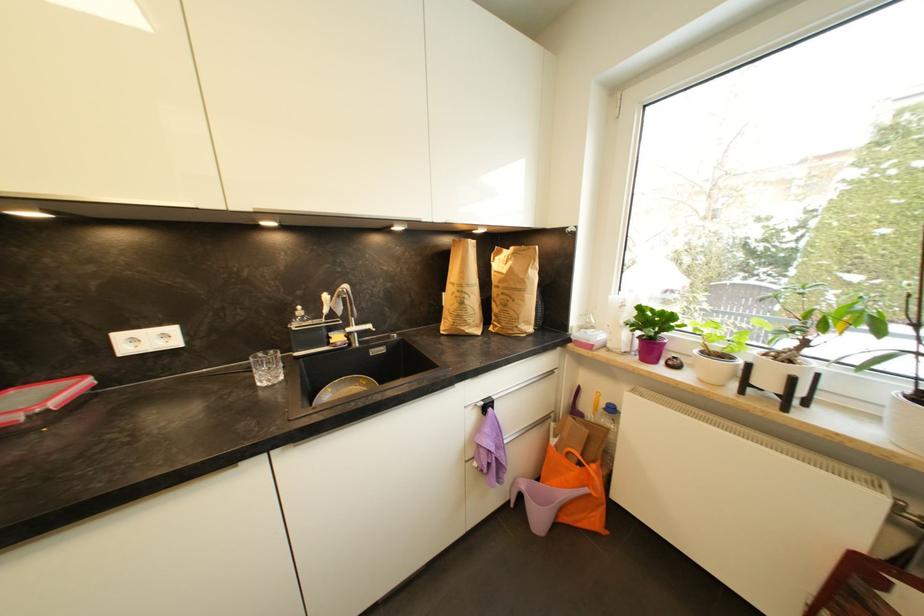
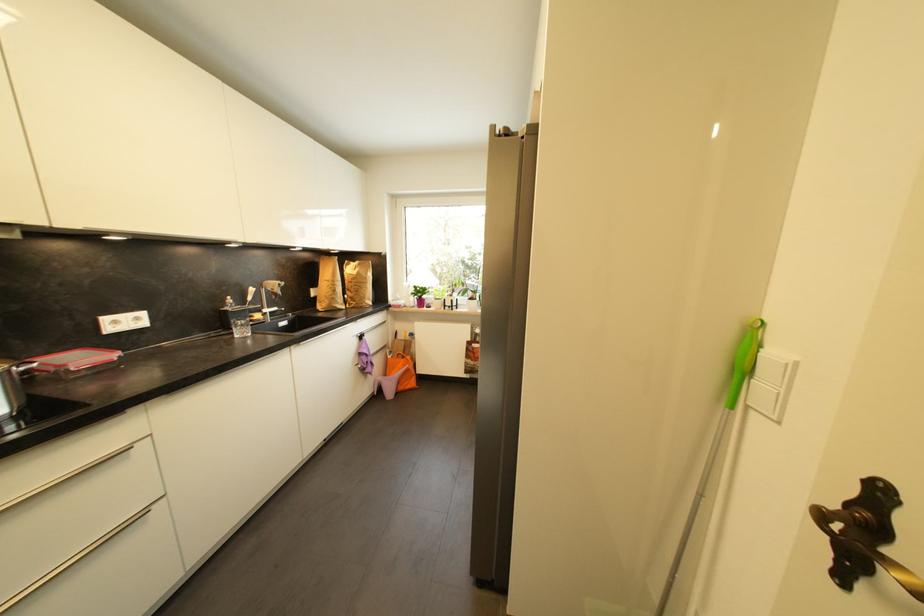
Locate, in the second image, the point that corresponds to point 169,338 in the first image.

(142, 321)